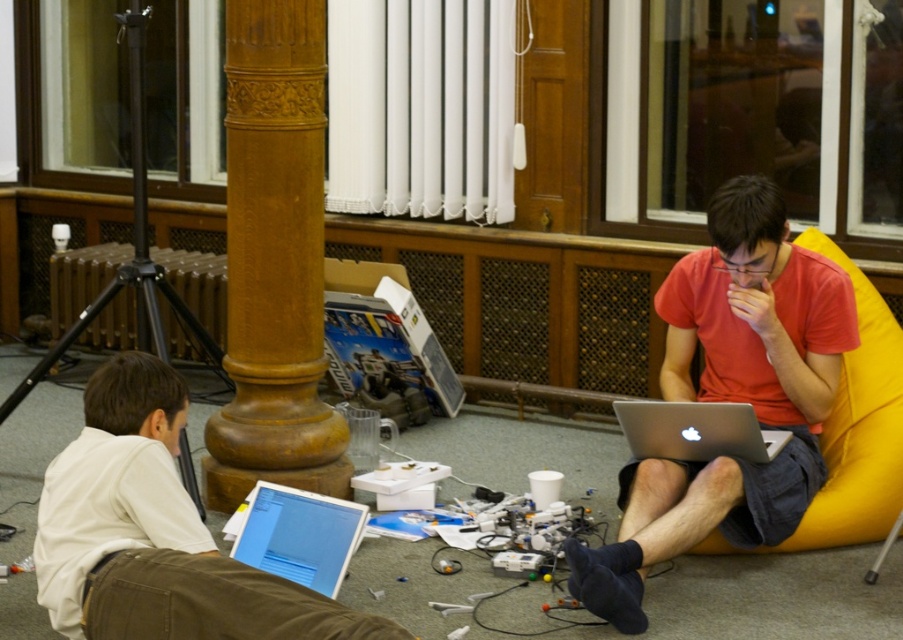
Question: Does white matte laptop at lower left appear on the right side of silver metallic laptop at center?

Choices:
 (A) yes
 (B) no

Answer: (B)

Question: Which of these objects is positioned farthest from the yellow fabric bean bag chair at right?

Choices:
 (A) white glossy laptop at lower left
 (B) wooden column at center
 (C) silver metallic laptop at center

Answer: (B)

Question: Which of these objects is positioned farthest from the wooden column at center?

Choices:
 (A) white glossy laptop at lower left
 (B) white matte laptop at lower left
 (C) silver metallic laptop at center

Answer: (C)

Question: Is yellow fabric bean bag chair at right thinner than white glossy laptop at lower left?

Choices:
 (A) no
 (B) yes

Answer: (A)

Question: Based on their relative distances, which object is farther from the silver metallic laptop at center?

Choices:
 (A) matte red shirt at center
 (B) white glossy laptop at lower left
 (C) white matte laptop at lower left

Answer: (C)

Question: Observing the image, what is the correct spatial positioning of white matte laptop at lower left in reference to silver metallic laptop at center?

Choices:
 (A) left
 (B) right

Answer: (A)